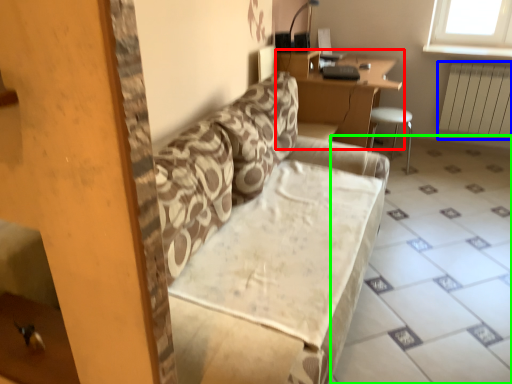
Question: Based on their relative distances, which object is farther from table (highlighted by a red box)? Choose from radiator (highlighted by a blue box) and tile (highlighted by a green box).

Choices:
 (A) radiator
 (B) tile

Answer: (A)